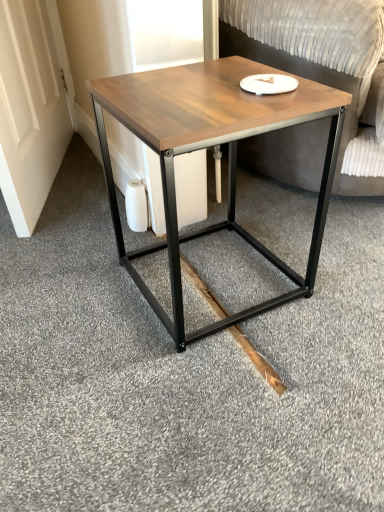
Describe the element at coordinates (207, 147) in the screenshot. I see `wooden matte coffee table at center` at that location.

Locate an element on the screen. The image size is (384, 512). wooden swivel chair at center is located at coordinates (321, 65).

I want to click on wooden matte coffee table at center, so click(207, 147).

Is natural wood plank at lower center positioned with its back to wooden swivel chair at center?

No, wooden swivel chair at center is not at the back of natural wood plank at lower center.

Is natural wood plank at lower center shorter than wooden swivel chair at center?

Yes, natural wood plank at lower center is shorter than wooden swivel chair at center.

Is point (196, 277) closer or farther from the camera than point (356, 40)?

Point (196, 277) is positioned farther from the camera compared to point (356, 40).

Where is `wood behind the wooden swivel chair at center`? wood behind the wooden swivel chair at center is located at coordinates (258, 361).

You are a GUI agent. You are given a task and a screenshot of the screen. Output one action in this format:
    pyautogui.click(x=<x>, y=<y>)
    Task: Click on the coffee table lying above the natural wood plank at lower center (from the image's perspective)
    The width and height of the screenshot is (384, 512).
    Given the screenshot: What is the action you would take?
    pyautogui.click(x=207, y=147)

From a real-world perspective, which object rests below the other?

In real-world perspective, natural wood plank at lower center is lower.

Would you say wooden matte coffee table at center is a long distance from natural wood plank at lower center?

No, wooden matte coffee table at center is not far away from natural wood plank at lower center.

Relative to natural wood plank at lower center, is wooden matte coffee table at center in front or behind?

Visually, wooden matte coffee table at center is located in front of natural wood plank at lower center.

Can you see wooden swivel chair at center touching natural wood plank at lower center?

wooden swivel chair at center and natural wood plank at lower center are clearly separated.

From a real-world perspective, is wooden swivel chair at center on natural wood plank at lower center?

Yes, from a real-world perspective, wooden swivel chair at center is above natural wood plank at lower center.

Considering the relative sizes of wooden swivel chair at center and natural wood plank at lower center in the image provided, is wooden swivel chair at center thinner than natural wood plank at lower center?

In fact, wooden swivel chair at center might be wider than natural wood plank at lower center.

From the image's perspective, who appears lower, wooden swivel chair at center or natural wood plank at lower center?

natural wood plank at lower center appears lower in the image.

Is wooden swivel chair at center not inside wooden matte coffee table at center?

Yes, wooden swivel chair at center is located beyond the bounds of wooden matte coffee table at center.

Consider the image. Who is more distant, wooden swivel chair at center or wooden matte coffee table at center?

wooden swivel chair at center is further from the camera.

Who is bigger, wooden swivel chair at center or wooden matte coffee table at center?

wooden swivel chair at center.

From the image's perspective, is wooden swivel chair at center under wooden matte coffee table at center?

No, from the image's perspective, wooden swivel chair at center is not beneath wooden matte coffee table at center.

From the image's perspective, who appears lower, wooden matte coffee table at center or wooden swivel chair at center?

From the image's view, wooden matte coffee table at center is below.

From a real-world perspective, is wooden matte coffee table at center located beneath wooden swivel chair at center?

Yes, from a real-world perspective, wooden matte coffee table at center is beneath wooden swivel chair at center.

Is wooden matte coffee table at center oriented away from wooden swivel chair at center?

No, wooden matte coffee table at center is not facing the opposite direction of wooden swivel chair at center.

Is there a large distance between wooden matte coffee table at center and wooden swivel chair at center?

That's not correct — wooden matte coffee table at center is a little close to wooden swivel chair at center.

From the image's perspective, does natural wood plank at lower center appear higher than wooden matte coffee table at center?

No.

From a real-world perspective, is natural wood plank at lower center physically located above or below wooden matte coffee table at center?

Clearly, from a real-world perspective, natural wood plank at lower center is below wooden matte coffee table at center.

Is natural wood plank at lower center positioned before wooden matte coffee table at center?

No, natural wood plank at lower center is further to the viewer.

Does natural wood plank at lower center appear on the left side of wooden matte coffee table at center?

No, natural wood plank at lower center is not to the left of wooden matte coffee table at center.

Locate an element on the screen. swivel chair located above the natural wood plank at lower center (from the image's perspective) is located at coordinates (321, 65).

What are the coordinates of `coffee table on the left of natural wood plank at lower center` in the screenshot? It's located at pyautogui.click(x=207, y=147).

Looking at the image, which one is located closer to wooden swivel chair at center, wooden matte coffee table at center or natural wood plank at lower center?

Based on the image, wooden matte coffee table at center appears to be nearer to wooden swivel chair at center.

Based on their spatial positions, is wooden matte coffee table at center or wooden swivel chair at center closer to natural wood plank at lower center?

wooden matte coffee table at center is closer to natural wood plank at lower center.

Estimate the real-world distances between objects in this image. Which object is further from wooden swivel chair at center, natural wood plank at lower center or wooden matte coffee table at center?

Among the two, natural wood plank at lower center is located further to wooden swivel chair at center.

Based on their spatial positions, is wooden swivel chair at center or natural wood plank at lower center closer to wooden matte coffee table at center?

wooden swivel chair at center.

Which object lies nearer to the anchor point wooden matte coffee table at center, natural wood plank at lower center or wooden swivel chair at center?

wooden swivel chair at center lies closer to wooden matte coffee table at center than the other object.

Looking at the image, which one is located further to natural wood plank at lower center, wooden swivel chair at center or wooden matte coffee table at center?

wooden swivel chair at center lies further to natural wood plank at lower center than the other object.

This screenshot has height=512, width=384. I want to click on coffee table between wooden swivel chair at center and natural wood plank at lower center in the up-down direction, so click(207, 147).